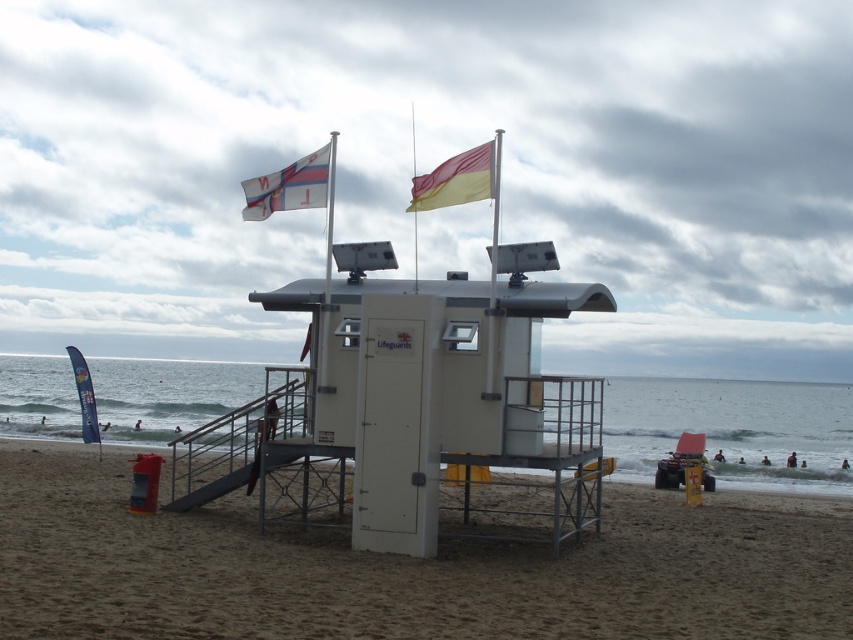
Between sandy brown at center and yellow matte flag at upper center, which one has more height?

With more height is yellow matte flag at upper center.

Is point (109, 536) positioned behind point (473, 154)?

That is False.

Locate an element on the screen. This screenshot has width=853, height=640. sandy brown at center is located at coordinates (405, 568).

In the scene shown: Is white fabric flag at upper center positioned behind yellow matte flag at upper center?

That is True.

Can you confirm if white fabric flag at upper center is smaller than yellow matte flag at upper center?

Correct, white fabric flag at upper center occupies less space than yellow matte flag at upper center.

Does point (312, 186) come farther from viewer compared to point (419, 182)?

No, (312, 186) is closer to viewer.

Where is `white fabric flag at upper center`? The width and height of the screenshot is (853, 640). white fabric flag at upper center is located at coordinates (291, 186).

Can you confirm if sandy brown at center is positioned below white fabric flag at upper center?

Yes, sandy brown at center is below white fabric flag at upper center.

Can you confirm if sandy brown at center is positioned above white fabric flag at upper center?

No, sandy brown at center is not above white fabric flag at upper center.

The width and height of the screenshot is (853, 640). What do you see at coordinates (405, 568) in the screenshot?
I see `sandy brown at center` at bounding box center [405, 568].

Locate an element on the screen. The image size is (853, 640). sandy brown at center is located at coordinates (405, 568).